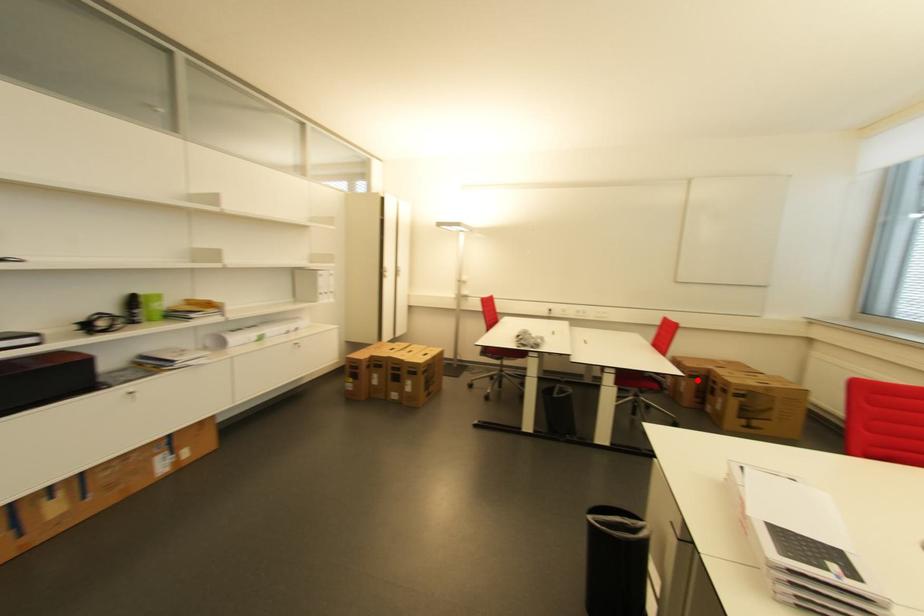
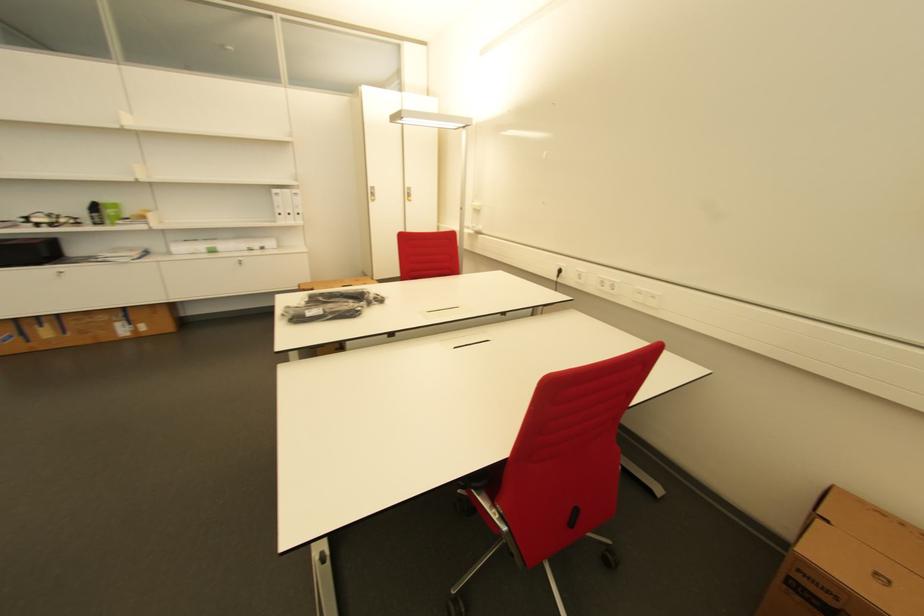
Where in the second image is the point corresponding to the highlighted location from the first image?

(805, 600)